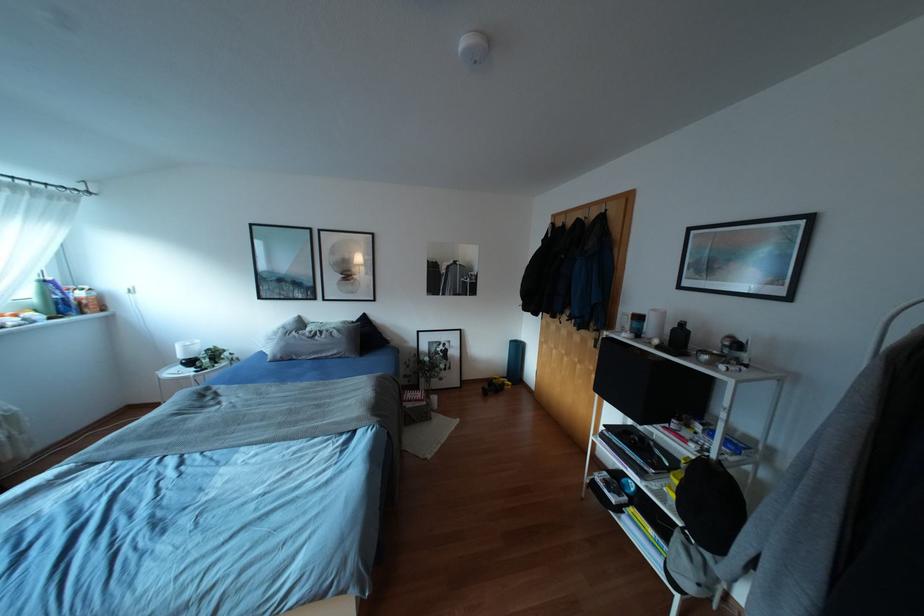
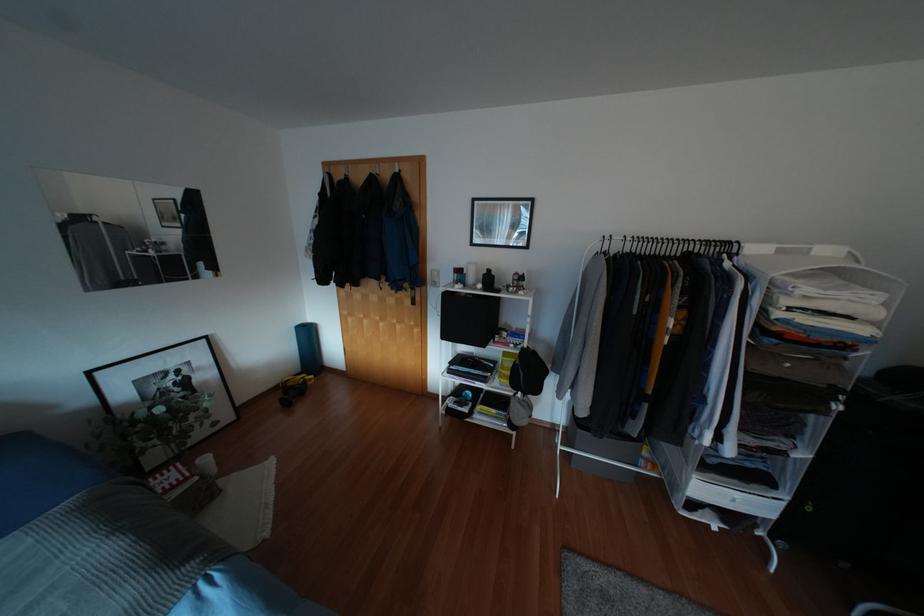
Find the pixel in the second image that matches (x=433, y=398) in the first image.

(205, 459)